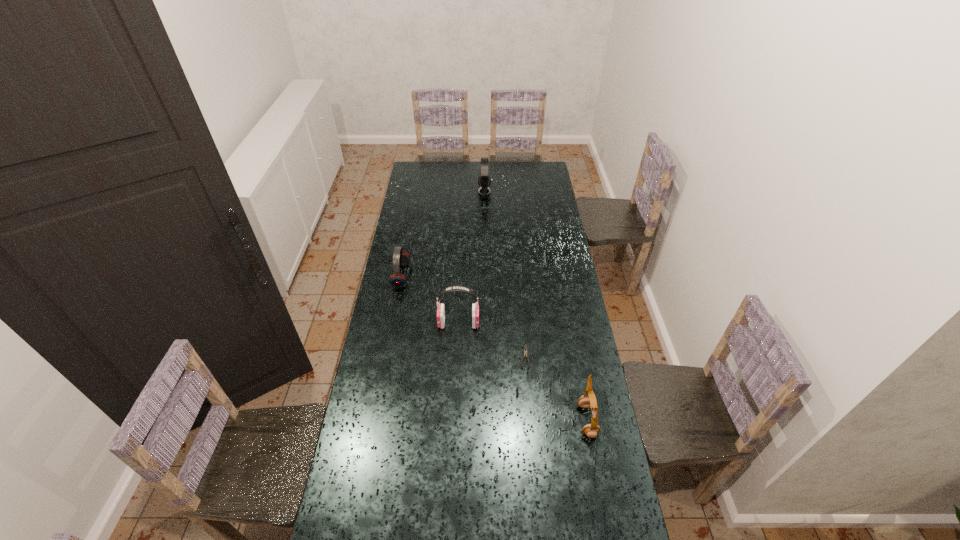
The width and height of the screenshot is (960, 540). I want to click on vacant space that's between the farthest earphone and the second farthest object, so click(443, 234).

Locate an element on the screen. Image resolution: width=960 pixels, height=540 pixels. vacant space in between the rightmost earphone and the second object from right to left is located at coordinates (556, 388).

The image size is (960, 540). I want to click on vacant space in between the second object from right to left and the shortest earphone, so click(x=463, y=316).

This screenshot has height=540, width=960. Find the location of `object that is the second closest to the rightmost earphone`. object that is the second closest to the rightmost earphone is located at coordinates (453, 288).

Locate which object ranks second in proximity to the farthest earphone. Please provide its 2D coordinates. Your answer should be formatted as a tuple, i.e. [(x, y)], where the tuple contains the x and y coordinates of a point satisfying the conditions above.

[(453, 288)]

At what (x,y) coordinates should I click in order to perform the action: click on the third closest earphone to the farthest object. Please return your answer as a coordinate pair (x, y). Looking at the image, I should click on (588, 399).

Select which earphone appears as the closest to the rightmost earphone. Please provide its 2D coordinates. Your answer should be formatted as a tuple, i.e. [(x, y)], where the tuple contains the x and y coordinates of a point satisfying the conditions above.

[(453, 288)]

You are a GUI agent. You are given a task and a screenshot of the screen. Output one action in this format:
    pyautogui.click(x=<x>, y=<y>)
    Task: Click on the free spot that satisfies the following two spatial constraints: 1. on the back side of the fourth farthest object; 2. on the ear cups of the shortest earphone
    The height and width of the screenshot is (540, 960).
    Given the screenshot: What is the action you would take?
    pyautogui.click(x=517, y=276)

Locate an element on the screen. vacant region that satisfies the following two spatial constraints: 1. on the outer surface of the third farthest earphone; 2. on the left side of the fourth object from left to right is located at coordinates (457, 357).

Find the location of a particular element. This screenshot has height=540, width=960. free spot that satisfies the following two spatial constraints: 1. on the ear cups of the fourth object from left to right; 2. on the left side of the farthest earphone is located at coordinates (487, 357).